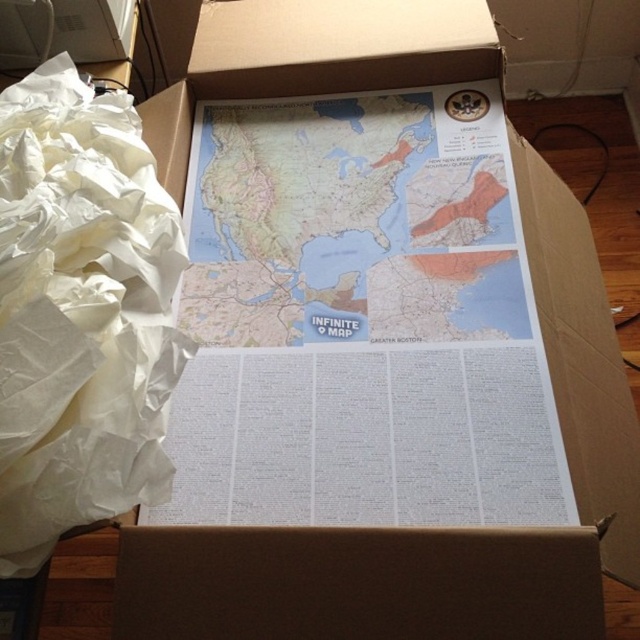
Consider the image. Measure the distance between point (332, 227) and camera.

Point (332, 227) and camera are 83.31 centimeters apart from each other.

Does matte paper map at center appear over white crumpled paper at left?

Yes.

Is point (436, 168) positioned after point (150, 344)?

Yes, point (436, 168) is behind point (150, 344).

You are a GUI agent. You are given a task and a screenshot of the screen. Output one action in this format:
    pyautogui.click(x=<x>, y=<y>)
    Task: Click on the matte paper map at center
    
    Given the screenshot: What is the action you would take?
    pyautogui.click(x=353, y=220)